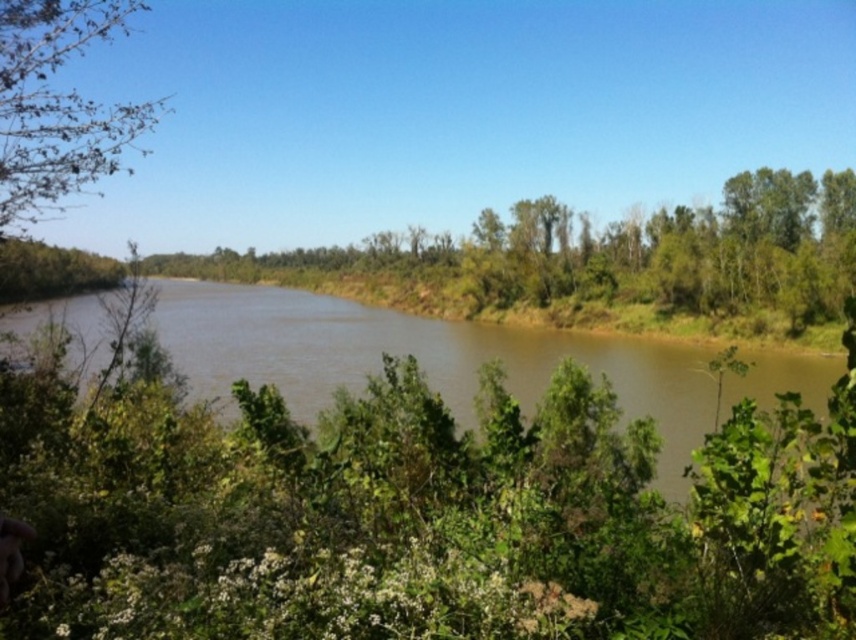
Does brown muddy water at center have a greater width compared to green leafy tree at upper left?

Correct, the width of brown muddy water at center exceeds that of green leafy tree at upper left.

Describe the element at coordinates (420, 358) in the screenshot. The image size is (856, 640). I see `brown muddy water at center` at that location.

Does point (825, 372) come in front of point (104, 1)?

No, (825, 372) is behind (104, 1).

Locate an element on the screen. This screenshot has width=856, height=640. brown muddy water at center is located at coordinates (420, 358).